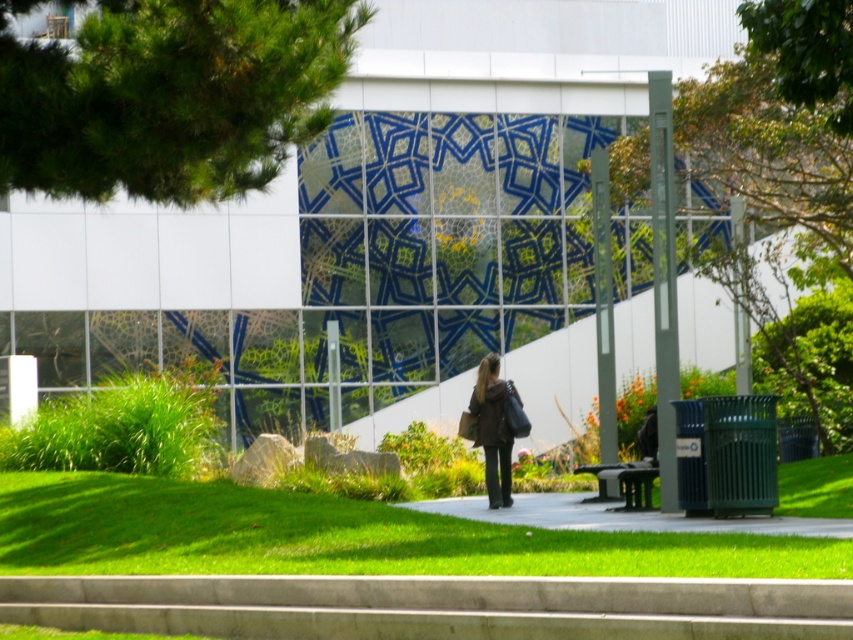
Question: Estimate the real-world distances between objects in this image. Which object is farther from the green leafy tree at upper right?

Choices:
 (A) green leafy tree at right
 (B) green leafy tree at upper left
 (C) green grass at lower center
 (D) dark brown leather jacket at center

Answer: (D)

Question: Can you confirm if green grass at lower center is wider than dark brown leather jacket at center?

Choices:
 (A) yes
 (B) no

Answer: (A)

Question: Does green leafy tree at upper left lie behind green leafy tree at right?

Choices:
 (A) no
 (B) yes

Answer: (B)

Question: Is green grass at lower center closer to camera compared to dark brown leather jacket at center?

Choices:
 (A) yes
 (B) no

Answer: (A)

Question: Which point is closer to the camera?

Choices:
 (A) (790, 154)
 (B) (737, 564)
 (C) (827, 38)
 (D) (492, 500)

Answer: (B)

Question: Which of the following is the farthest from the observer?

Choices:
 (A) (755, 19)
 (B) (822, 570)

Answer: (A)